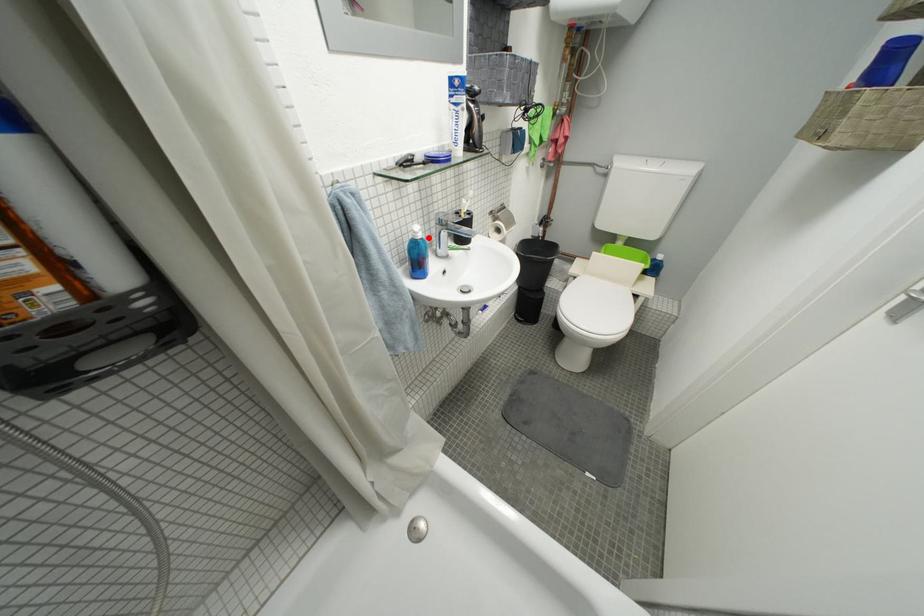
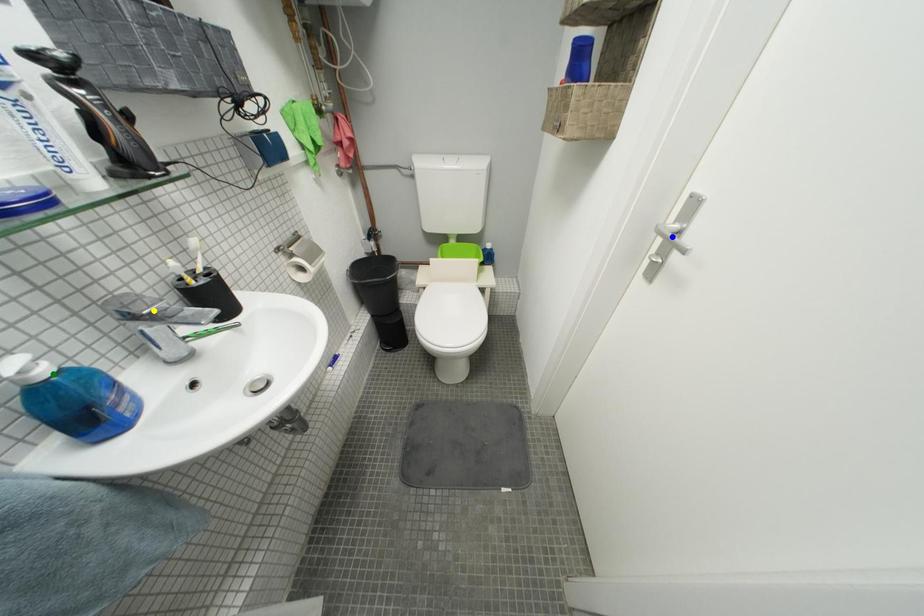
Question: I am providing you with two images of the same scene from different viewpoints. A red point is marked on the first image. You are given multiple points on the second image. Which point in image 2 is actually the same real-world point as the red point in image 1?

Choices:
 (A) yellow point
 (B) blue point
 (C) green point

Answer: (C)